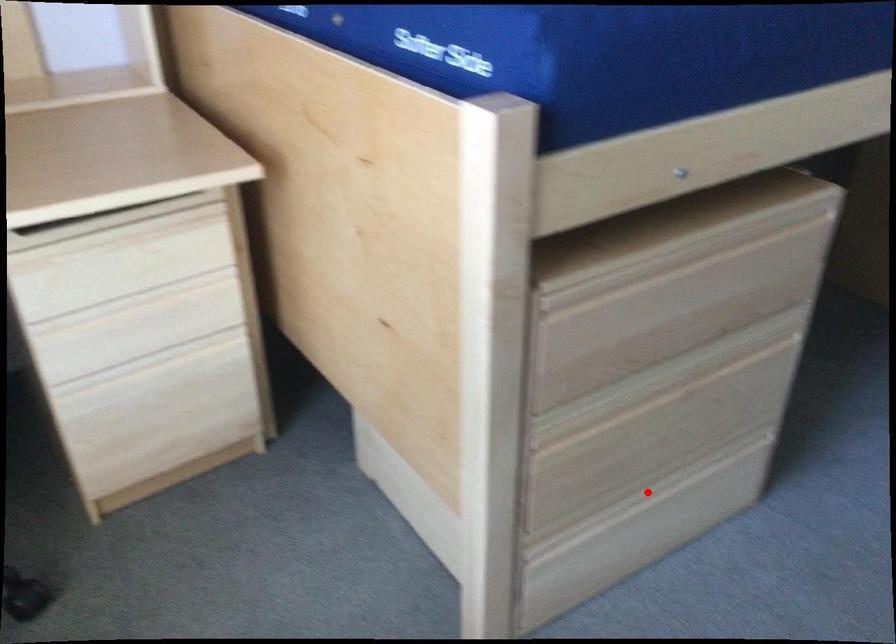
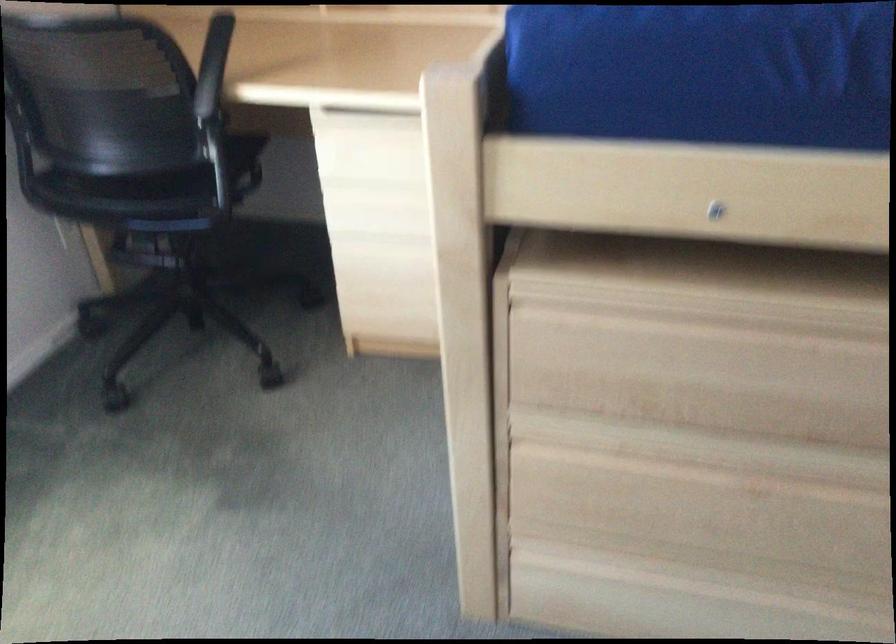
Question: A red point is marked in image1. In image2, is the corresponding 3D point closer to the camera or farther? Reply with the corresponding letter.

Choices:
 (A) The corresponding 3D point is closer.
 (B) The corresponding 3D point is farther.

Answer: (A)